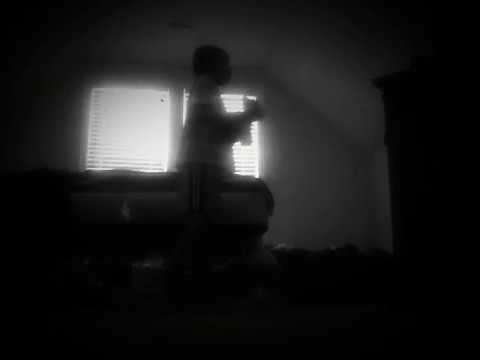
Where is `bed`? This screenshot has width=480, height=360. bed is located at coordinates (128, 194).